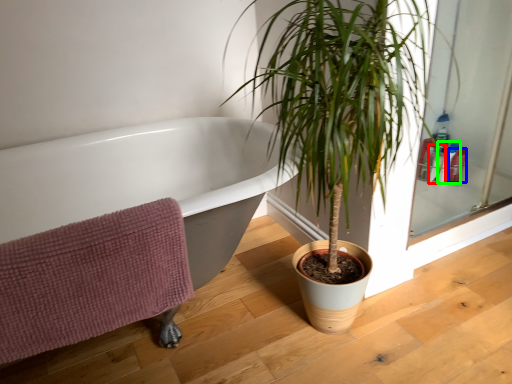
Question: Which object is positioned farthest from toiletry (highlighted by a red box)? Select from toiletry (highlighted by a blue box) and toiletry (highlighted by a green box).

Choices:
 (A) toiletry
 (B) toiletry

Answer: (A)